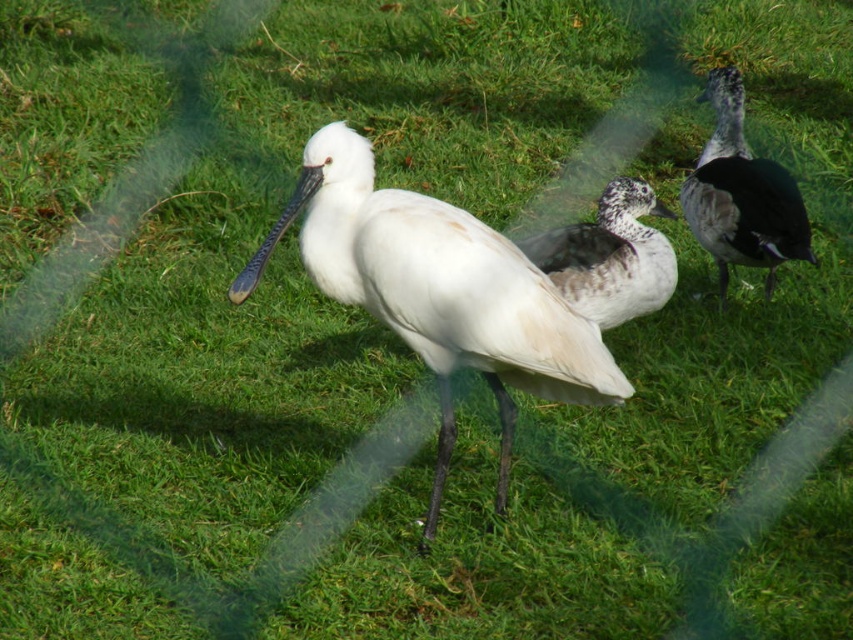
You are a birdwatcher observing the scene. You notice the white matte bird at center and the speckled gray duck at right. Which bird is taller?

The white matte bird at center is much taller than the speckled gray duck at right.

You are standing at the center of the image. Which direction should you move to reach the speckled gray duck at right?

The speckled gray duck at right is located at point 0.305 on the x axis and 0.870 on the y axis. Since you are at the center, you should move to the right and upwards to reach it.

You are a wildlife photographer aiming to capture a photo of the speckled gray duck at right and the speckled white duck at center. Which duck is narrower in width?

The speckled gray duck at right is narrower in width than the speckled white duck at center.